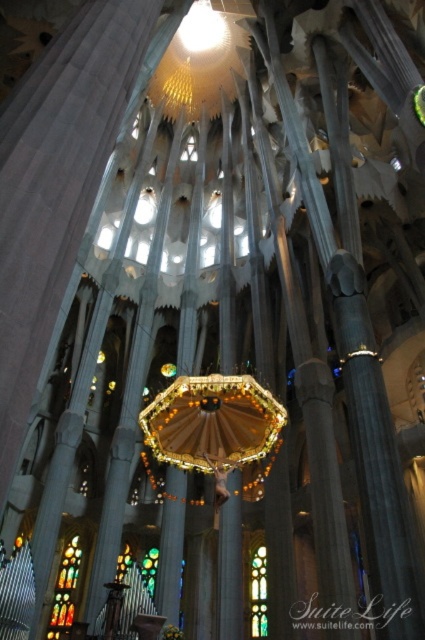
You are an architect examining the cathedral from below. You notice the stained glass window at lower left and the multicolored stained glass at center. Which of these two objects appears taller from your vantage point?

The stained glass window at lower left appears taller than the multicolored stained glass at center because it has a greater height compared to it.

You are standing inside the cathedral and looking up at the ceiling. There are two points marked in the image. Which point, point (67, 605) or point (252, 577), is closer to your eyes?

Point (67, 605) is closer to the camera than point (252, 577), so it is closer to your eyes.